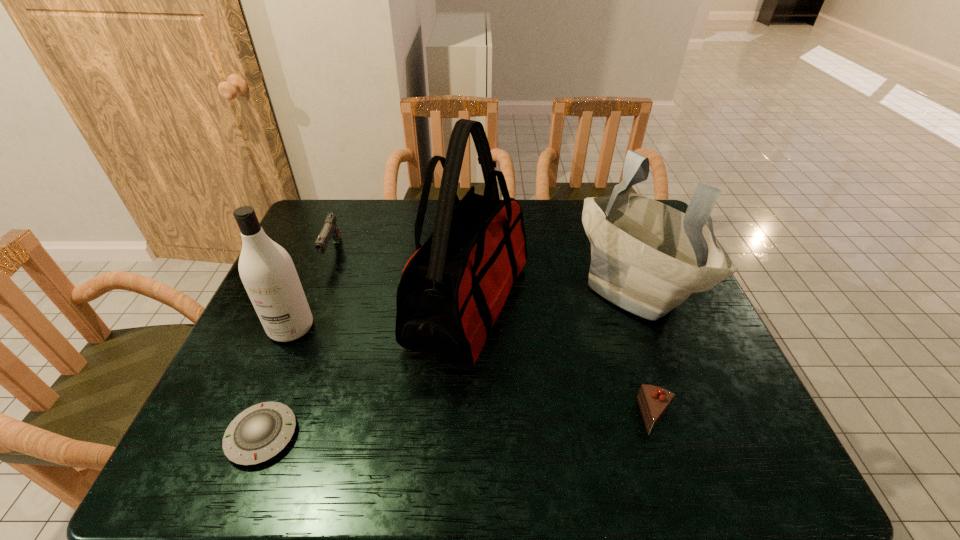
The image size is (960, 540). In order to click on free space between the tallest object and the shopping bag in this screenshot , I will do `click(552, 296)`.

This screenshot has width=960, height=540. I want to click on free spot between the shampoo and the fourth tallest object, so click(312, 290).

In order to click on unoccupied area between the fourth object from left to right and the gun in this screenshot , I will do `click(400, 279)`.

What are the coordinates of `the closest object to the third object from right to left` in the screenshot? It's located at (647, 258).

Locate an element on the screen. The width and height of the screenshot is (960, 540). object identified as the closest to the shampoo is located at coordinates (330, 230).

Find the location of a particular element. The image size is (960, 540). free spot that satisfies the following two spatial constraints: 1. on the front-facing side of the second shortest object; 2. on the right side of the shampoo is located at coordinates (253, 416).

I want to click on free space in the image that satisfies the following two spatial constraints: 1. in the direction the shortest object is aimed; 2. on the right side of the fourth tallest object, so click(x=260, y=436).

The image size is (960, 540). In order to click on vacant space that satisfies the following two spatial constraints: 1. in the direction the shopping bag is aimed; 2. on the left side of the fourth tallest object in this screenshot , I will do `click(319, 287)`.

Where is `vacant point that satisfies the following two spatial constraints: 1. in the direction the gun is aimed; 2. on the right side of the chocolate cake`? vacant point that satisfies the following two spatial constraints: 1. in the direction the gun is aimed; 2. on the right side of the chocolate cake is located at coordinates (268, 416).

At what (x,y) coordinates should I click in order to perform the action: click on vacant space that satisfies the following two spatial constraints: 1. on the front-facing side of the saucer; 2. on the right side of the shampoo. Please return your answer as a coordinate pair (x, y). Image resolution: width=960 pixels, height=540 pixels. Looking at the image, I should click on (246, 436).